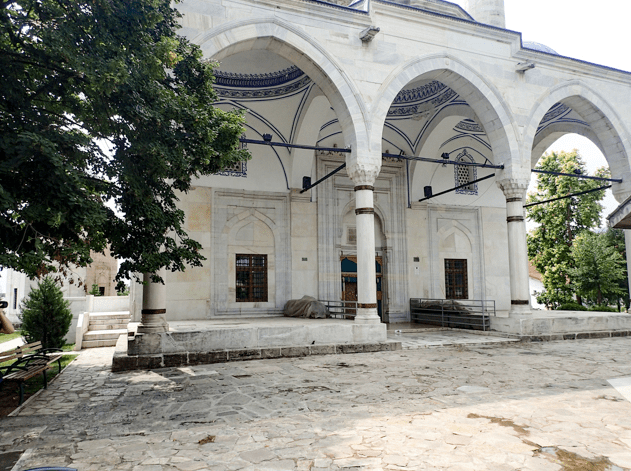
The image size is (631, 471). What are the coordinates of `column` in the screenshot? It's located at pyautogui.click(x=628, y=239), pyautogui.click(x=519, y=262), pyautogui.click(x=372, y=281), pyautogui.click(x=153, y=295).